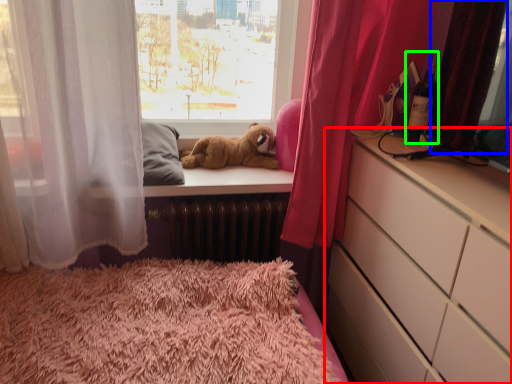
Question: Which object is the closest to the chest of drawers (highlighted by a red box)? Choose among these: curtain (highlighted by a blue box) or bottle (highlighted by a green box).

Choices:
 (A) curtain
 (B) bottle

Answer: (A)